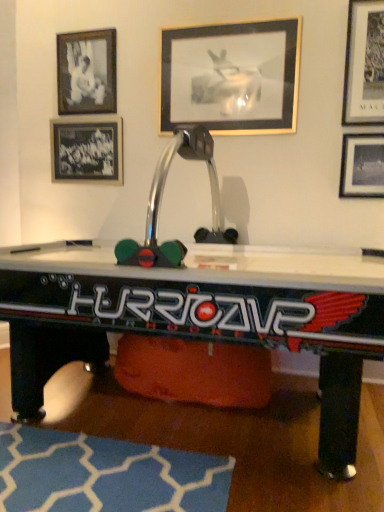
Question: From a real-world perspective, is metallic silver air hockey table at center above or below black glass picture frame at upper left, marked as the 5th picture frame in a right-to-left arrangement?

Choices:
 (A) above
 (B) below

Answer: (B)

Question: From their relative heights in the image, would you say metallic silver air hockey table at center is taller or shorter than black glass picture frame at upper left, marked as the 5th picture frame in a right-to-left arrangement?

Choices:
 (A) short
 (B) tall

Answer: (B)

Question: Estimate the real-world distances between objects in this image. Which object is farther from the blue fabric rug at lower center?

Choices:
 (A) metallic silver air hockey table at center
 (B) black matte photo frame at upper left, positioned as the 2th picture frame in left-to-right order
 (C) black glass picture frame at upper left, the 1th picture frame when ordered from left to right
 (D) metallic silver picture frame at upper right, placed as the 1th picture frame when sorted from right to left
 (E) metallic silver picture frame at upper center, the third picture frame when ordered from left to right

Answer: (B)

Question: Which object is positioned farthest from the black glass picture frame at upper left, marked as the 5th picture frame in a right-to-left arrangement?

Choices:
 (A) metallic silver air hockey table at center
 (B) metallic silver picture frame at upper right, marked as the 5th picture frame in a left-to-right arrangement
 (C) black matte photo frame at upper left, positioned as the 2th picture frame in left-to-right order
 (D) blue fabric rug at lower center
 (E) metallic silver picture frame at upper right, which is the 2th picture frame in right-to-left order

Answer: (D)